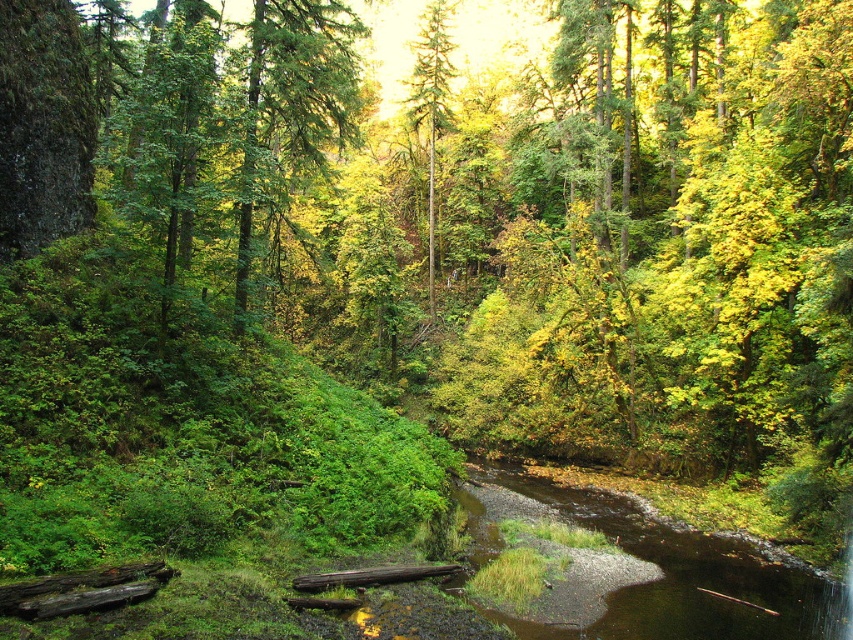
Question: Is brown gravel river at center further to camera compared to green matte tree at center?

Choices:
 (A) no
 (B) yes

Answer: (A)

Question: Among these points, which one is nearest to the camera?

Choices:
 (A) (434, 35)
 (B) (616, 506)

Answer: (B)

Question: Which object appears closest to the camera in this image?

Choices:
 (A) brown gravel river at center
 (B) green matte tree at center

Answer: (A)

Question: Which point appears farthest from the camera in this image?

Choices:
 (A) (428, 200)
 (B) (512, 483)

Answer: (A)

Question: Is brown gravel river at center smaller than green matte tree at center?

Choices:
 (A) yes
 (B) no

Answer: (A)

Question: Can you confirm if brown gravel river at center is positioned to the right of green matte tree at center?

Choices:
 (A) no
 (B) yes

Answer: (B)